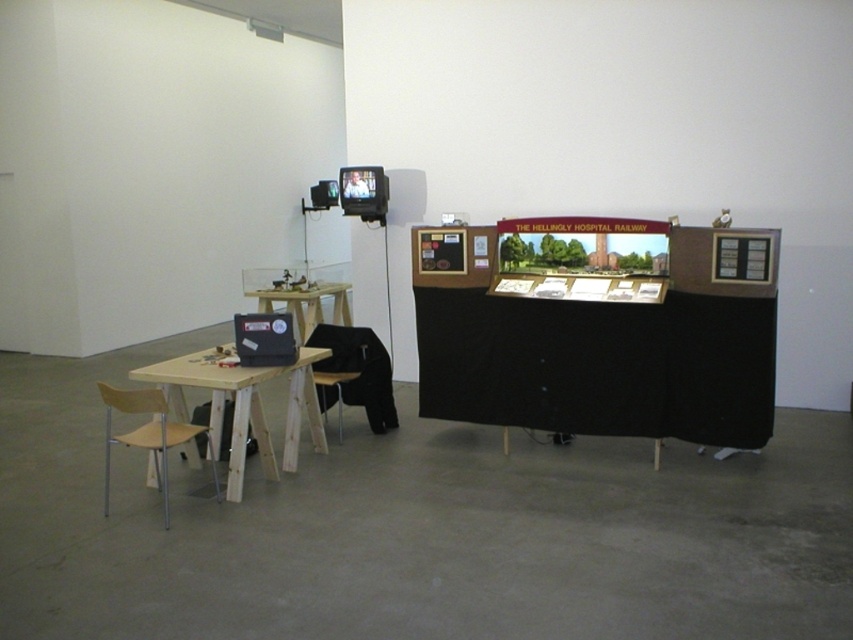
Question: Can you confirm if wooden table at lower left is positioned to the left of wooden table at left?

Choices:
 (A) no
 (B) yes

Answer: (A)

Question: Which point appears farthest from the camera in this image?

Choices:
 (A) (175, 372)
 (B) (386, 397)
 (C) (285, 296)

Answer: (C)

Question: Does black fabric chair at lower left appear on the right side of wooden table at left?

Choices:
 (A) yes
 (B) no

Answer: (A)

Question: Considering the relative positions of black fabric chair at lower left and wooden table at left in the image provided, where is black fabric chair at lower left located with respect to wooden table at left?

Choices:
 (A) below
 (B) above

Answer: (A)

Question: Which object is positioned farthest from the wooden table at left?

Choices:
 (A) black fabric chair at lower left
 (B) wooden table at lower left

Answer: (B)

Question: Which object is positioned farthest from the black fabric chair at lower left?

Choices:
 (A) wooden table at lower left
 (B) wooden table at left

Answer: (B)